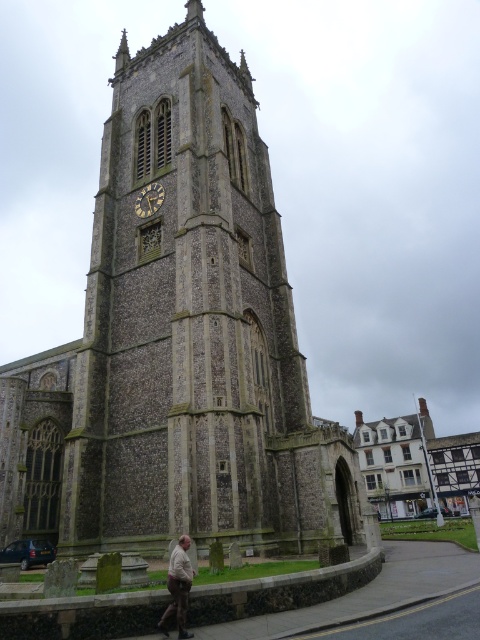
Is point (289, 385) farther from camera compared to point (157, 184)?

No.

Consider the image. Is stone clock tower at center taller than gold textured clock at center?

Yes, stone clock tower at center is taller than gold textured clock at center.

Which is behind, point (120, 186) or point (142, 216)?

Positioned behind is point (120, 186).

You are a GUI agent. You are given a task and a screenshot of the screen. Output one action in this format:
    pyautogui.click(x=<x>, y=<y>)
    Task: Click on the stone clock tower at center
    The image size is (480, 640).
    Given the screenshot: What is the action you would take?
    pyautogui.click(x=179, y=342)

Can you confirm if stone clock tower at center is shorter than brown leather jacket at lower center?

No, stone clock tower at center is not shorter than brown leather jacket at lower center.

Can you confirm if stone clock tower at center is taller than brown leather jacket at lower center?

Yes, stone clock tower at center is taller than brown leather jacket at lower center.

Measure the distance between point (x=165, y=276) and camera.

Point (x=165, y=276) is 55.61 meters from camera.

Locate an element on the screen. stone clock tower at center is located at coordinates (179, 342).

Is point (170, 589) positioned in front of point (151, 211)?

Yes, point (170, 589) is in front of point (151, 211).

What do you see at coordinates (178, 588) in the screenshot? I see `brown leather jacket at lower center` at bounding box center [178, 588].

Locate an element on the screen. brown leather jacket at lower center is located at coordinates (178, 588).